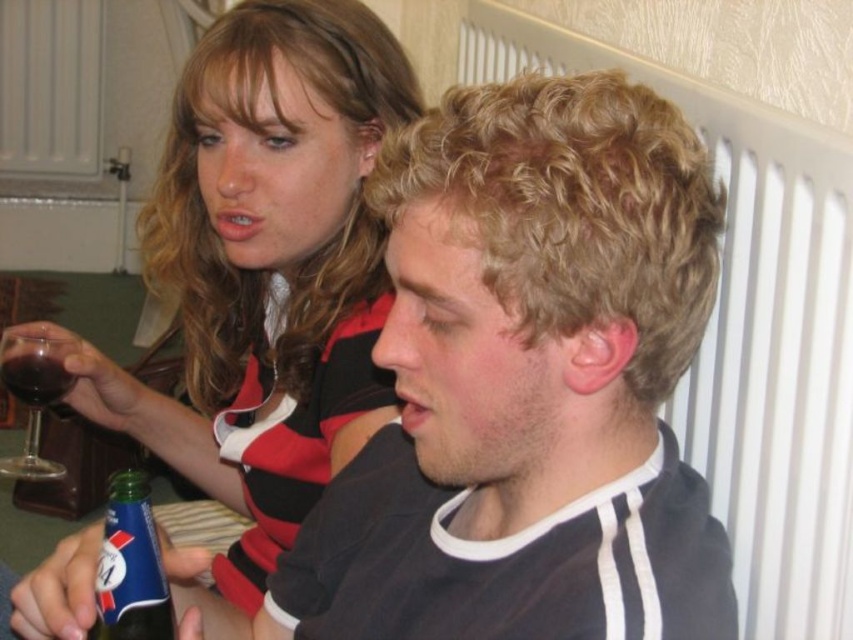
You are a photographer setting up for an event and need to position a spotlight. The spotlight can only illuminate objects in the frontmost layer. Which object should you aim the spotlight at to ensure it hits the matte black shirt at upper left or the white plastic radiator at upper right?

The white plastic radiator at upper right is behind the matte black shirt at upper left, so the spotlight should be aimed at the matte black shirt at upper left since it is in the frontmost layer and will be illuminated first.

You are at a party and need to choose a drink. You prefer something slim and easy to hold. Which of the two drinks, the green glass bottle at lower left or the dark red glass at upper left, would you choose?

The green glass bottle at lower left is thinner than the dark red glass at upper left, so you should choose the green glass bottle at lower left as it is slimmer and easier to hold.

You are standing in the room and want to place a new poster between the matte black shirt at upper left and the white plastic radiator at upper right. Based on their positions, which object should the poster be closer to?

The poster should be placed closer to the white plastic radiator at upper right because the matte black shirt at upper left is to the left of it, meaning the radiator is on the right side relative to the shirt.